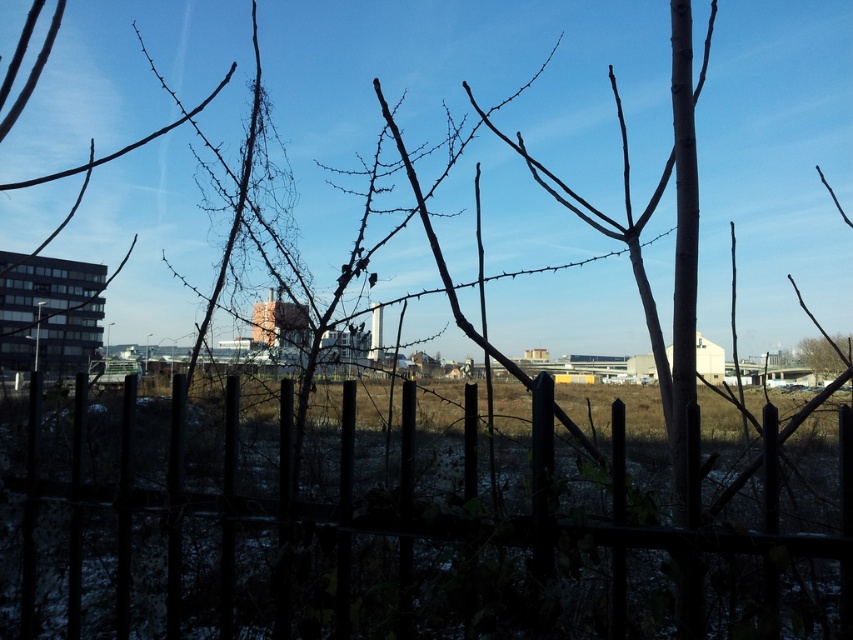
Question: Does black metal fence at lower center have a greater width compared to brown rough tree at right?

Choices:
 (A) yes
 (B) no

Answer: (A)

Question: Can you confirm if black metal fence at lower center is wider than brown rough tree at right?

Choices:
 (A) no
 (B) yes

Answer: (B)

Question: In this image, where is black metal fence at lower center located relative to brown rough tree at right?

Choices:
 (A) above
 (B) below

Answer: (B)

Question: Which object appears closest to the camera in this image?

Choices:
 (A) black metal fence at lower center
 (B) brown rough tree at right

Answer: (A)

Question: Which object appears closest to the camera in this image?

Choices:
 (A) black metal fence at lower center
 (B) brown rough tree at right

Answer: (A)